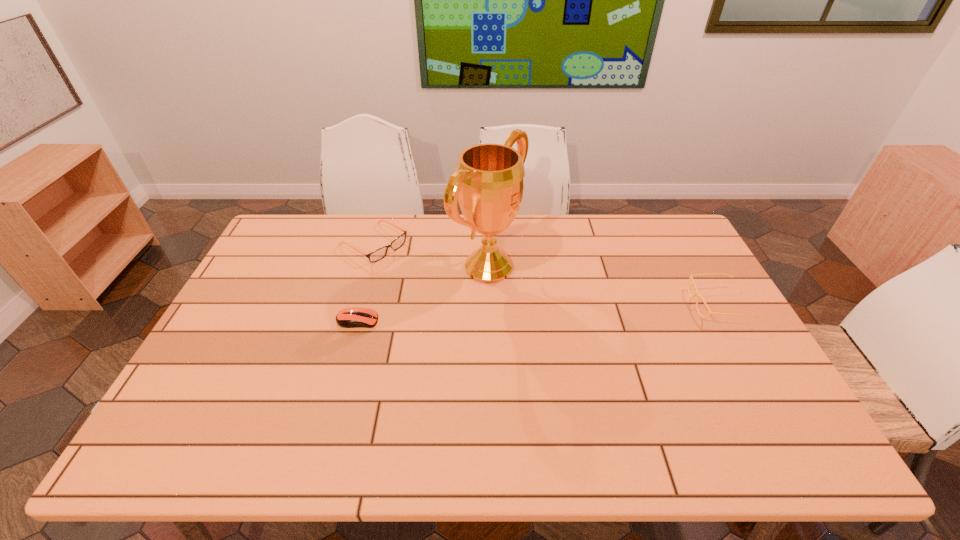
You are a GUI agent. You are given a task and a screenshot of the screen. Output one action in this format:
    pyautogui.click(x=<x>, y=<y>)
    Task: Click on the vacant space situated 0.190m on the front-facing side of the farther spectacles
    
    Given the screenshot: What is the action you would take?
    pyautogui.click(x=437, y=284)

You are a GUI agent. You are given a task and a screenshot of the screen. Output one action in this format:
    pyautogui.click(x=<x>, y=<y>)
    Task: Click on the free spot located 0.160m on the front-facing side of the farther spectacles
    
    Given the screenshot: What is the action you would take?
    pyautogui.click(x=430, y=279)

This screenshot has width=960, height=540. In order to click on blank area located 0.200m on the front-facing side of the farther spectacles in this screenshot , I will do `click(439, 285)`.

Image resolution: width=960 pixels, height=540 pixels. I want to click on free space located 0.100m on the front-facing side of the tallest object, so click(550, 299).

This screenshot has width=960, height=540. Find the location of `free space located on the front-facing side of the tallest object`. free space located on the front-facing side of the tallest object is located at coordinates (547, 298).

The width and height of the screenshot is (960, 540). Find the location of `vacant space located on the front-facing side of the tallest object`. vacant space located on the front-facing side of the tallest object is located at coordinates (588, 314).

Identify the location of spectacles that is at the far edge. This screenshot has width=960, height=540. (380, 253).

Find the location of a particular element. award situated at the far edge is located at coordinates (488, 182).

Locate an element on the screen. object situated at the right edge is located at coordinates (696, 290).

Locate an element on the screen. vacant space at the far edge of the desktop is located at coordinates (353, 220).